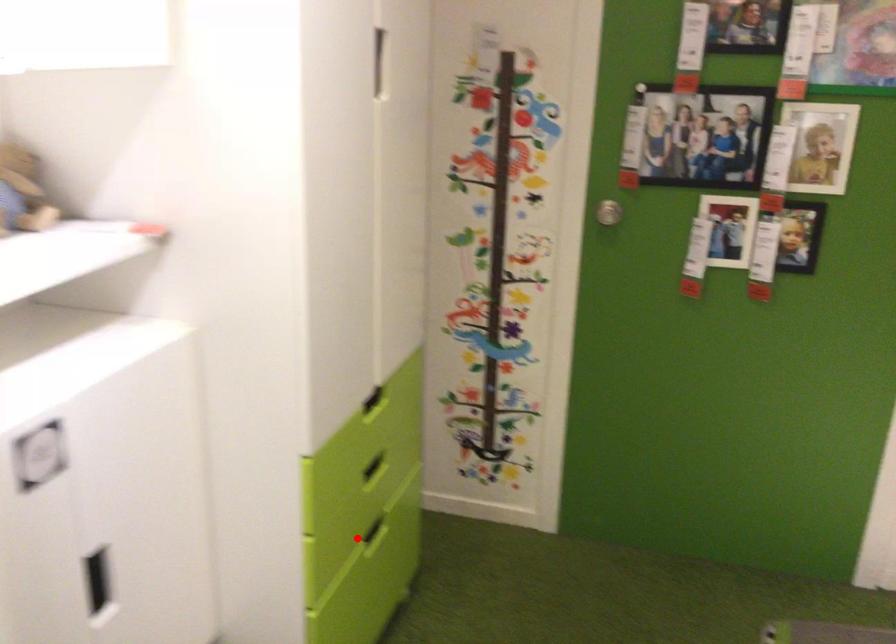
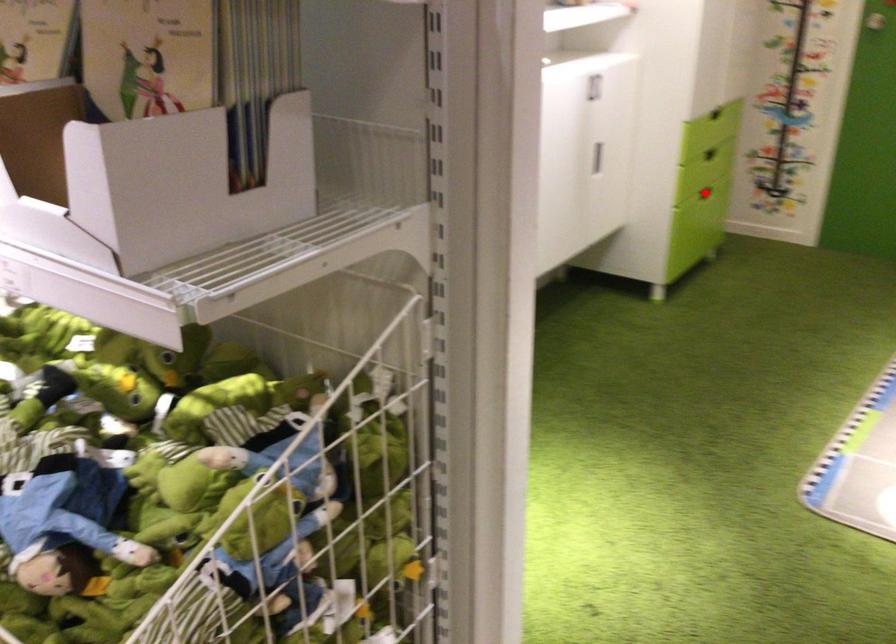
I am providing you with two images of the same scene from different viewpoints. A red point is marked on the first image and another point is marked on the second image. Does the point marked in image1 correspond to the same location as the one in image2?

Yes